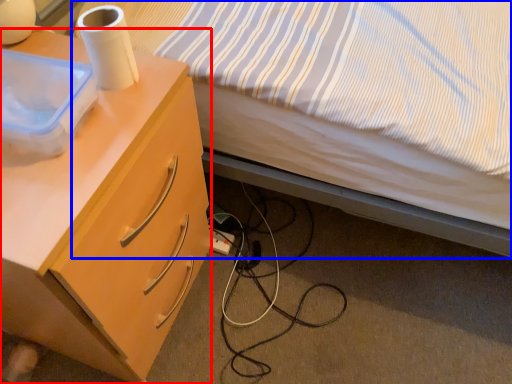
Question: Among these objects, which one is nearest to the camera, desk (highlighted by a red box) or bed (highlighted by a blue box)?

Choices:
 (A) desk
 (B) bed

Answer: (B)